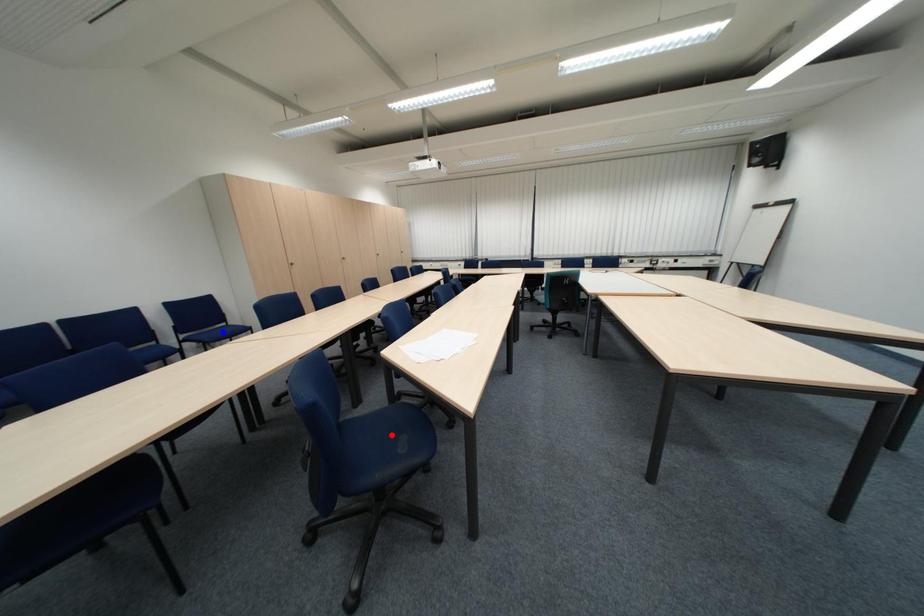
Question: Which of the two points in the image is closer to the camera?

Choices:
 (A) Blue point is closer.
 (B) Red point is closer.

Answer: (B)